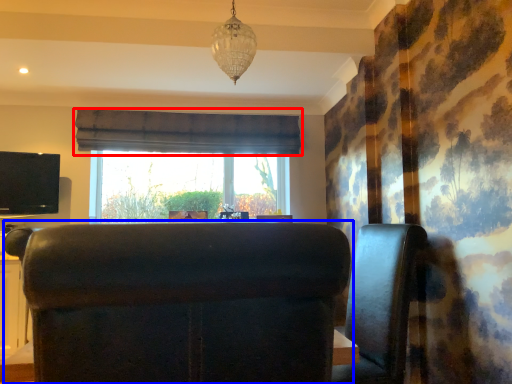
Question: Which of the following is the closest to the observer, curtain (highlighted by a red box) or furniture (highlighted by a blue box)?

Choices:
 (A) curtain
 (B) furniture

Answer: (B)